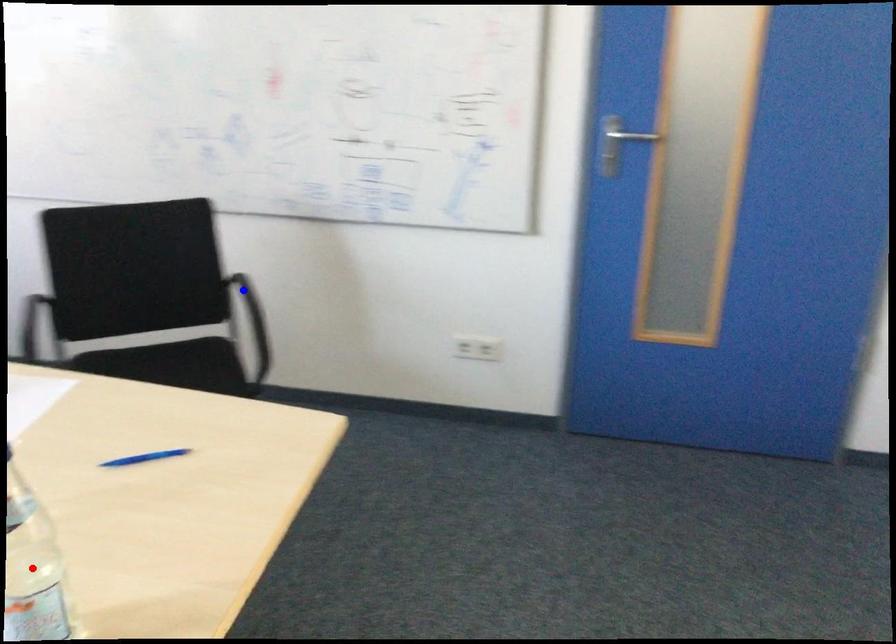
Question: Which of the two points in the image is closer to the camera?

Choices:
 (A) Blue point is closer.
 (B) Red point is closer.

Answer: (B)